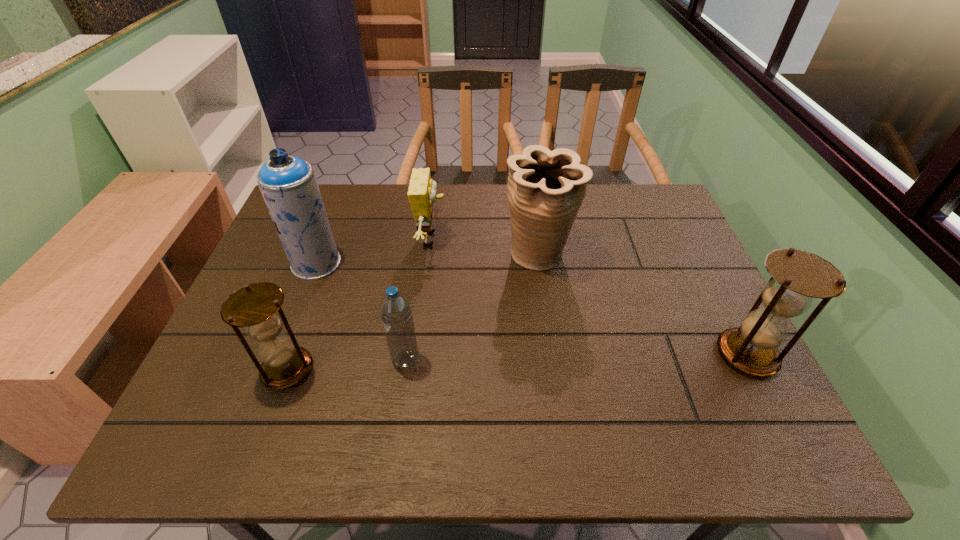
The height and width of the screenshot is (540, 960). Identify the location of the shorter hourglass. (x=257, y=307).

Find the location of a particular element. the rightmost object is located at coordinates (798, 276).

Locate an element on the screen. the taller hourglass is located at coordinates tap(798, 276).

Where is `urn`? The image size is (960, 540). urn is located at coordinates (546, 189).

Where is `sponge`? sponge is located at coordinates (422, 190).

You are a GUI agent. You are given a task and a screenshot of the screen. Output one action in this format:
    pyautogui.click(x=<x>, y=<y>)
    Task: Click on the water bottle
    
    Given the screenshot: What is the action you would take?
    pyautogui.click(x=395, y=309)

Where is `the tallest object`? the tallest object is located at coordinates (288, 184).

Locate an element on the screen. This screenshot has width=960, height=540. vacant area located on the right of the shorter hourglass is located at coordinates (445, 369).

Where is `free space located 0.060m on the back of the rightmost object`? free space located 0.060m on the back of the rightmost object is located at coordinates (725, 311).

Identify the location of free space located on the left of the urn. (378, 255).